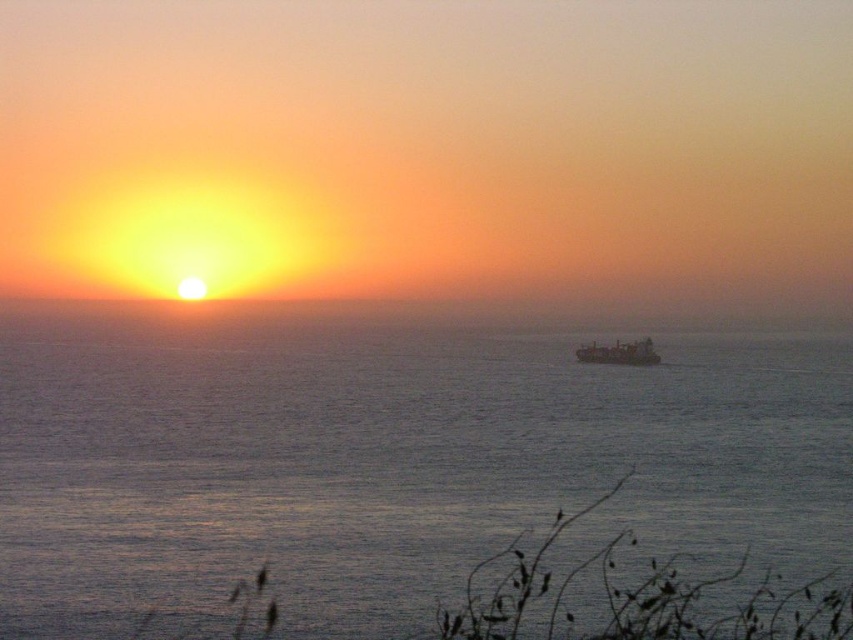
Based on the photo, how distant is blue water at center from metallic gray ship at center?

75.55 meters

Is point (73, 330) in front of point (610, 348)?

That is False.

Identify the location of blue water at center. The image size is (853, 640). (395, 452).